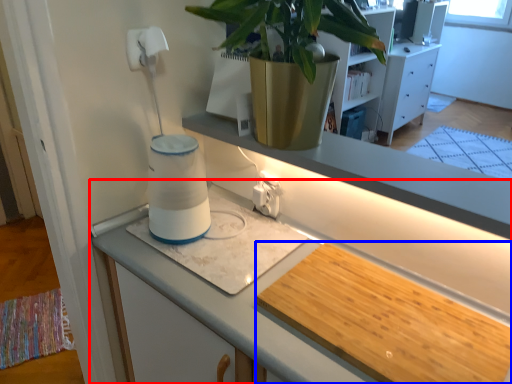
Question: Which of the following is the closest to the observer, cabinetry (highlighted by a red box) or wide (highlighted by a blue box)?

Choices:
 (A) cabinetry
 (B) wide

Answer: (A)